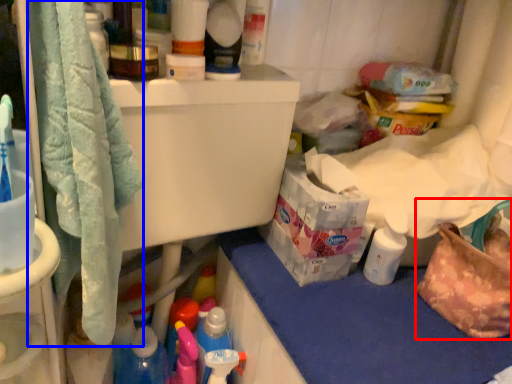
Question: Among these objects, which one is nearest to the camera, handbag (highlighted by a red box) or bath towel (highlighted by a blue box)?

Choices:
 (A) handbag
 (B) bath towel

Answer: (B)